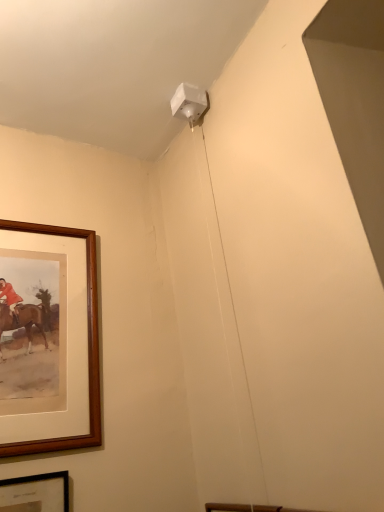
How much space does brown wooden picture frame at left, the first picture frame when ordered from top to bottom, occupy vertically?

The height of brown wooden picture frame at left, the first picture frame when ordered from top to bottom, is 25.48 inches.

This screenshot has height=512, width=384. What are the coordinates of `brown wooden picture frame at left, marked as the second picture frame in a bottom-to-top arrangement` in the screenshot? It's located at (88, 349).

Describe the element at coordinates (88, 349) in the screenshot. I see `brown wooden picture frame at left, marked as the second picture frame in a bottom-to-top arrangement` at that location.

Image resolution: width=384 pixels, height=512 pixels. What do you see at coordinates (35, 493) in the screenshot?
I see `wooden picture frame at lower left, marked as the second picture frame in a top-to-bottom arrangement` at bounding box center [35, 493].

How much space does wooden picture frame at lower left, acting as the 1th picture frame starting from the bottom, occupy vertically?

wooden picture frame at lower left, acting as the 1th picture frame starting from the bottom, is 17.64 inches in height.

You are a GUI agent. You are given a task and a screenshot of the screen. Output one action in this format:
    pyautogui.click(x=<x>, y=<y>)
    Task: Click on the wooden picture frame at lower left, acting as the 1th picture frame starting from the bottom
    This screenshot has height=512, width=384.
    Given the screenshot: What is the action you would take?
    pyautogui.click(x=35, y=493)

Measure the distance between point (36,499) and camera.

Point (36,499) is 1.01 meters from camera.

In order to face wooden picture frame at lower left, marked as the second picture frame in a top-to-bottom arrangement, should I rotate leftwards or rightwards?

You should rotate left by 25.521 degrees.

Where is `brown wooden picture frame at left, the first picture frame when ordered from top to bottom`? Image resolution: width=384 pixels, height=512 pixels. brown wooden picture frame at left, the first picture frame when ordered from top to bottom is located at coordinates (88, 349).

Is brown wooden picture frame at left, the first picture frame when ordered from top to bottom, to the left or to the right of wooden picture frame at lower left, marked as the second picture frame in a top-to-bottom arrangement, in the image?

brown wooden picture frame at left, the first picture frame when ordered from top to bottom, is to the right of wooden picture frame at lower left, marked as the second picture frame in a top-to-bottom arrangement.

Relative to wooden picture frame at lower left, acting as the 1th picture frame starting from the bottom, is brown wooden picture frame at left, the first picture frame when ordered from top to bottom, in front or behind?

In the image, brown wooden picture frame at left, the first picture frame when ordered from top to bottom, appears behind wooden picture frame at lower left, acting as the 1th picture frame starting from the bottom.

Between point (36, 451) and point (40, 497), which one is positioned behind?

The point (36, 451) is farther from the camera.

From the image's perspective, is brown wooden picture frame at left, marked as the second picture frame in a bottom-to-top arrangement, positioned above or below wooden picture frame at lower left, marked as the second picture frame in a top-to-bottom arrangement?

From the image's perspective, brown wooden picture frame at left, marked as the second picture frame in a bottom-to-top arrangement, appears above wooden picture frame at lower left, marked as the second picture frame in a top-to-bottom arrangement.

From a real-world perspective, which object rests below the other?

wooden picture frame at lower left, acting as the 1th picture frame starting from the bottom, is physically lower.

Is brown wooden picture frame at left, the first picture frame when ordered from top to bottom, thinner than wooden picture frame at lower left, acting as the 1th picture frame starting from the bottom?

In fact, brown wooden picture frame at left, the first picture frame when ordered from top to bottom, might be wider than wooden picture frame at lower left, acting as the 1th picture frame starting from the bottom.

Does brown wooden picture frame at left, the first picture frame when ordered from top to bottom, have a greater height compared to wooden picture frame at lower left, acting as the 1th picture frame starting from the bottom?

Correct, brown wooden picture frame at left, the first picture frame when ordered from top to bottom, is much taller as wooden picture frame at lower left, acting as the 1th picture frame starting from the bottom.

Looking at the image, does brown wooden picture frame at left, the first picture frame when ordered from top to bottom, seem bigger or smaller compared to wooden picture frame at lower left, marked as the second picture frame in a top-to-bottom arrangement?

In the image, brown wooden picture frame at left, the first picture frame when ordered from top to bottom, appears to be larger than wooden picture frame at lower left, marked as the second picture frame in a top-to-bottom arrangement.

Looking at this image, does brown wooden picture frame at left, marked as the second picture frame in a bottom-to-top arrangement, contain wooden picture frame at lower left, acting as the 1th picture frame starting from the bottom?

No, wooden picture frame at lower left, acting as the 1th picture frame starting from the bottom, is located outside of brown wooden picture frame at left, marked as the second picture frame in a bottom-to-top arrangement.

Looking at this image, are brown wooden picture frame at left, the first picture frame when ordered from top to bottom, and wooden picture frame at lower left, acting as the 1th picture frame starting from the bottom, making contact?

No, brown wooden picture frame at left, the first picture frame when ordered from top to bottom, is not in contact with wooden picture frame at lower left, acting as the 1th picture frame starting from the bottom.

Is brown wooden picture frame at left, marked as the second picture frame in a bottom-to-top arrangement, oriented away from wooden picture frame at lower left, marked as the second picture frame in a top-to-bottom arrangement?

No, brown wooden picture frame at left, marked as the second picture frame in a bottom-to-top arrangement, is not facing away from wooden picture frame at lower left, marked as the second picture frame in a top-to-bottom arrangement.

How different are the orientations of brown wooden picture frame at left, marked as the second picture frame in a bottom-to-top arrangement, and wooden picture frame at lower left, acting as the 1th picture frame starting from the bottom, in degrees?

The angle between the facing direction of brown wooden picture frame at left, marked as the second picture frame in a bottom-to-top arrangement, and the facing direction of wooden picture frame at lower left, acting as the 1th picture frame starting from the bottom, is 0.00597 degrees.

Measure the distance between brown wooden picture frame at left, the first picture frame when ordered from top to bottom, and wooden picture frame at lower left, marked as the second picture frame in a top-to-bottom arrangement.

9.42 inches.

Locate an element on the screen. This screenshot has width=384, height=512. picture frame below the brown wooden picture frame at left, the first picture frame when ordered from top to bottom (from a real-world perspective) is located at coordinates (35, 493).

Considering the relative positions of wooden picture frame at lower left, acting as the 1th picture frame starting from the bottom, and brown wooden picture frame at left, marked as the second picture frame in a bottom-to-top arrangement, in the image provided, is wooden picture frame at lower left, acting as the 1th picture frame starting from the bottom, to the left of brown wooden picture frame at left, marked as the second picture frame in a bottom-to-top arrangement, from the viewer's perspective?

Yes, wooden picture frame at lower left, acting as the 1th picture frame starting from the bottom, is to the left of brown wooden picture frame at left, marked as the second picture frame in a bottom-to-top arrangement.

Considering the positions of objects wooden picture frame at lower left, marked as the second picture frame in a top-to-bottom arrangement, and brown wooden picture frame at left, the first picture frame when ordered from top to bottom, in the image provided, who is behind, wooden picture frame at lower left, marked as the second picture frame in a top-to-bottom arrangement, or brown wooden picture frame at left, the first picture frame when ordered from top to bottom,?

brown wooden picture frame at left, the first picture frame when ordered from top to bottom.

Does point (13, 479) come in front of point (54, 232)?

Yes, it is in front of point (54, 232).

From the image's perspective, which one is positioned lower, wooden picture frame at lower left, marked as the second picture frame in a top-to-bottom arrangement, or brown wooden picture frame at left, marked as the second picture frame in a bottom-to-top arrangement?

wooden picture frame at lower left, marked as the second picture frame in a top-to-bottom arrangement, from the image's perspective.

From a real-world perspective, which object stands above the other?

From a 3D spatial view, brown wooden picture frame at left, the first picture frame when ordered from top to bottom, is above.

Considering the sizes of objects wooden picture frame at lower left, acting as the 1th picture frame starting from the bottom, and brown wooden picture frame at left, marked as the second picture frame in a bottom-to-top arrangement, in the image provided, who is thinner, wooden picture frame at lower left, acting as the 1th picture frame starting from the bottom, or brown wooden picture frame at left, marked as the second picture frame in a bottom-to-top arrangement,?

wooden picture frame at lower left, acting as the 1th picture frame starting from the bottom, is thinner.

In terms of height, does wooden picture frame at lower left, acting as the 1th picture frame starting from the bottom, look taller or shorter compared to brown wooden picture frame at left, the first picture frame when ordered from top to bottom?

Clearly, wooden picture frame at lower left, acting as the 1th picture frame starting from the bottom, is shorter compared to brown wooden picture frame at left, the first picture frame when ordered from top to bottom.

Who is bigger, wooden picture frame at lower left, acting as the 1th picture frame starting from the bottom, or brown wooden picture frame at left, the first picture frame when ordered from top to bottom?

brown wooden picture frame at left, the first picture frame when ordered from top to bottom, is bigger.

Is wooden picture frame at lower left, marked as the second picture frame in a top-to-bottom arrangement, inside the boundaries of brown wooden picture frame at left, marked as the second picture frame in a bottom-to-top arrangement, or outside?

wooden picture frame at lower left, marked as the second picture frame in a top-to-bottom arrangement, cannot be found inside brown wooden picture frame at left, marked as the second picture frame in a bottom-to-top arrangement.

Is wooden picture frame at lower left, acting as the 1th picture frame starting from the bottom, next to brown wooden picture frame at left, marked as the second picture frame in a bottom-to-top arrangement?

wooden picture frame at lower left, acting as the 1th picture frame starting from the bottom, and brown wooden picture frame at left, marked as the second picture frame in a bottom-to-top arrangement, are not in contact.

Could you tell me if wooden picture frame at lower left, acting as the 1th picture frame starting from the bottom, is facing brown wooden picture frame at left, the first picture frame when ordered from top to bottom?

No.

You are a GUI agent. You are given a task and a screenshot of the screen. Output one action in this format:
    pyautogui.click(x=<x>, y=<y>)
    Task: Click on the picture frame that is on the right side of wooden picture frame at lower left, acting as the 1th picture frame starting from the bottom
    Image resolution: width=384 pixels, height=512 pixels.
    Given the screenshot: What is the action you would take?
    pyautogui.click(x=88, y=349)

Image resolution: width=384 pixels, height=512 pixels. Find the location of `picture frame behind the wooden picture frame at lower left, acting as the 1th picture frame starting from the bottom`. picture frame behind the wooden picture frame at lower left, acting as the 1th picture frame starting from the bottom is located at coordinates (88, 349).

This screenshot has height=512, width=384. Find the location of `picture frame below the brown wooden picture frame at left, the first picture frame when ordered from top to bottom (from a real-world perspective)`. picture frame below the brown wooden picture frame at left, the first picture frame when ordered from top to bottom (from a real-world perspective) is located at coordinates (35, 493).